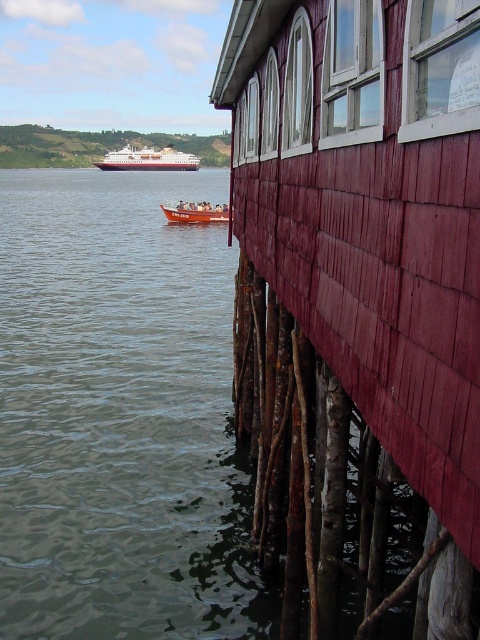
Does wooden shingles hut at right come in front of white glossy cruise ship at upper left?

Yes.

Can you confirm if wooden shingles hut at right is positioned above white glossy cruise ship at upper left?

Incorrect, wooden shingles hut at right is not positioned above white glossy cruise ship at upper left.

Locate an element on the screen. wooden shingles hut at right is located at coordinates (371, 211).

Does wooden shingles hut at right have a larger size compared to orange fiberglass boat at center?

No, wooden shingles hut at right is not bigger than orange fiberglass boat at center.

Is point (343, 200) positioned after point (200, 209)?

No, it is not.

Is point (475, 220) positioned before point (195, 204)?

That is True.

I want to click on wooden shingles hut at right, so click(371, 211).

How distant is white glossy cruise ship at upper left from orange fiberglass boat at center?

They are 131.95 meters apart.

Which is behind, point (128, 145) or point (191, 208)?

Positioned behind is point (128, 145).

The image size is (480, 640). In order to click on white glossy cruise ship at upper left in this screenshot , I will do `click(147, 160)`.